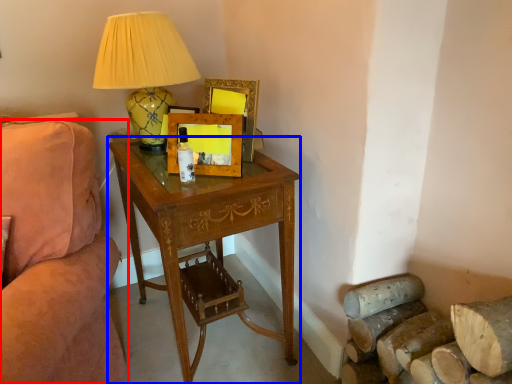
Question: Which object is further to the camera taking this photo, studio couch (highlighted by a red box) or desk (highlighted by a blue box)?

Choices:
 (A) studio couch
 (B) desk

Answer: (B)